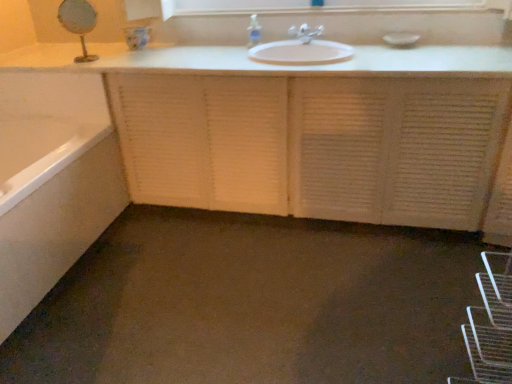
Question: From the image's perspective, is clear plastic soap dispenser at upper center located beneath gold metallic mirror at upper left?

Choices:
 (A) yes
 (B) no

Answer: (B)

Question: Is clear plastic soap dispenser at upper center oriented away from gold metallic mirror at upper left?

Choices:
 (A) no
 (B) yes

Answer: (A)

Question: Can you confirm if clear plastic soap dispenser at upper center is shorter than gold metallic mirror at upper left?

Choices:
 (A) no
 (B) yes

Answer: (B)

Question: Does clear plastic soap dispenser at upper center appear on the right side of gold metallic mirror at upper left?

Choices:
 (A) no
 (B) yes

Answer: (B)

Question: Is clear plastic soap dispenser at upper center to the left of gold metallic mirror at upper left from the viewer's perspective?

Choices:
 (A) yes
 (B) no

Answer: (B)

Question: Is white glossy medicine cabinet at upper center taller or shorter than white glossy bathtub at lower left?

Choices:
 (A) tall
 (B) short

Answer: (B)

Question: Considering the positions of point (202, 1) and point (119, 198), is point (202, 1) closer or farther from the camera than point (119, 198)?

Choices:
 (A) closer
 (B) farther

Answer: (B)

Question: Based on their sizes in the image, would you say white glossy medicine cabinet at upper center is bigger or smaller than white glossy bathtub at lower left?

Choices:
 (A) big
 (B) small

Answer: (B)

Question: From a real-world perspective, is white glossy medicine cabinet at upper center physically located above or below white glossy bathtub at lower left?

Choices:
 (A) below
 (B) above

Answer: (B)

Question: From the image's perspective, is matte white faucet at center located above or below white glossy medicine cabinet at upper center?

Choices:
 (A) above
 (B) below

Answer: (B)

Question: Do you think matte white faucet at center is within white glossy medicine cabinet at upper center, or outside of it?

Choices:
 (A) outside
 (B) inside

Answer: (A)

Question: Does point (303, 39) appear closer or farther from the camera than point (437, 3)?

Choices:
 (A) farther
 (B) closer

Answer: (A)

Question: Is matte white faucet at center to the left or to the right of white glossy medicine cabinet at upper center in the image?

Choices:
 (A) right
 (B) left

Answer: (B)

Question: Is matte white faucet at center taller or shorter than clear plastic soap dispenser at upper center?

Choices:
 (A) tall
 (B) short

Answer: (B)

Question: Is matte white faucet at center inside the boundaries of clear plastic soap dispenser at upper center, or outside?

Choices:
 (A) outside
 (B) inside

Answer: (A)